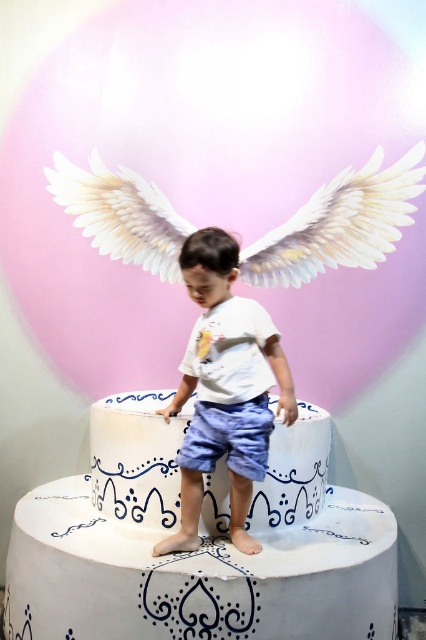
From the picture: You are an artist trying to paint this scene. You need to decide the order to paint the objects so that the closer ones are painted first. Which object should you paint first, the white feathered wings at upper center or the white cotton shirt at center?

The white feathered wings at upper center should be painted first because it is closer to the viewer than the white cotton shirt at center.

Based on the scene description, which object is smaller in size between the white feathered wings at upper center and the white cotton shirt at center?

The white feathered wings at upper center is smaller than the white cotton shirt at center.

From the picture: You are a photographer setting up for a photo shoot. You need to ensure that both the white feathered wings at upper center and the white glossy cake at center are visible in the frame. Based on their heights, which object should you adjust your camera angle to focus on first?

The white feathered wings at upper center are taller than the white glossy cake at center, so you should adjust your camera angle to focus on the white feathered wings at upper center first to ensure both are in frame.